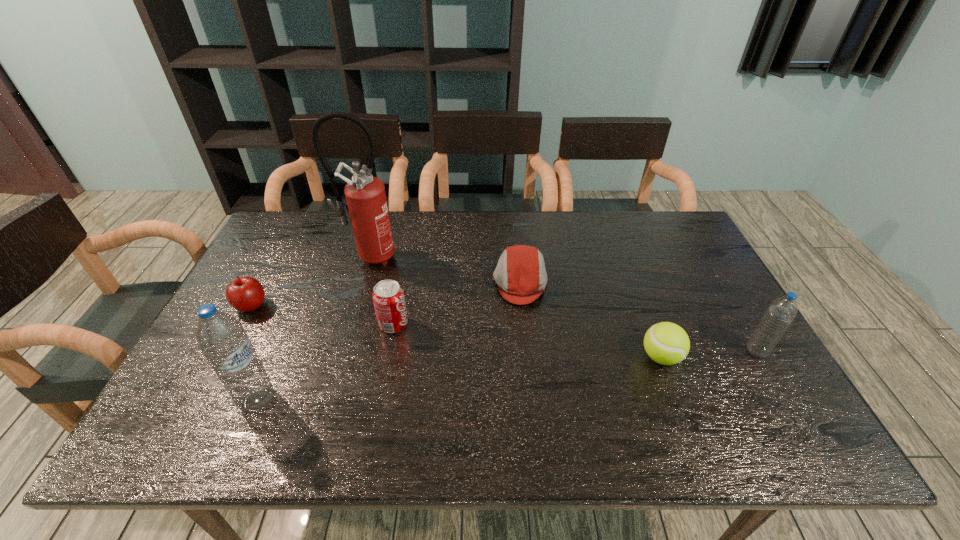
Where is `vacant space that satisfies the following two spatial constraints: 1. on the back side of the tennis ball; 2. on the front-facing side of the cap`? The width and height of the screenshot is (960, 540). vacant space that satisfies the following two spatial constraints: 1. on the back side of the tennis ball; 2. on the front-facing side of the cap is located at coordinates (633, 282).

The image size is (960, 540). Identify the location of vacant region that satisfies the following two spatial constraints: 1. on the back side of the second object from right to left; 2. on the front-facing side of the cap. [633, 282].

What are the coordinates of `vacant point that satisfies the following two spatial constraints: 1. on the front-facing side of the sixth object from left to right; 2. on the right side of the fifth object from left to right` in the screenshot? It's located at (528, 357).

Find the location of a particular element. This screenshot has height=540, width=960. vacant space that satisfies the following two spatial constraints: 1. on the front-facing side of the tennis ball; 2. on the right side of the third object from right to left is located at coordinates (528, 357).

Find the location of `vacant space that satisfies the following two spatial constraints: 1. on the front-facing side of the tennis ball; 2. on the right side of the fifth object from left to right`. vacant space that satisfies the following two spatial constraints: 1. on the front-facing side of the tennis ball; 2. on the right side of the fifth object from left to right is located at coordinates (528, 357).

Identify the location of free space that satisfies the following two spatial constraints: 1. on the front-facing side of the cap; 2. on the front side of the apple. This screenshot has width=960, height=540. (522, 306).

At what (x,y) coordinates should I click in order to perform the action: click on blank space that satisfies the following two spatial constraints: 1. at the nozzle of the tennis ball; 2. on the left side of the tallest object. Please return your answer as a coordinate pair (x, y). The height and width of the screenshot is (540, 960). Looking at the image, I should click on (341, 357).